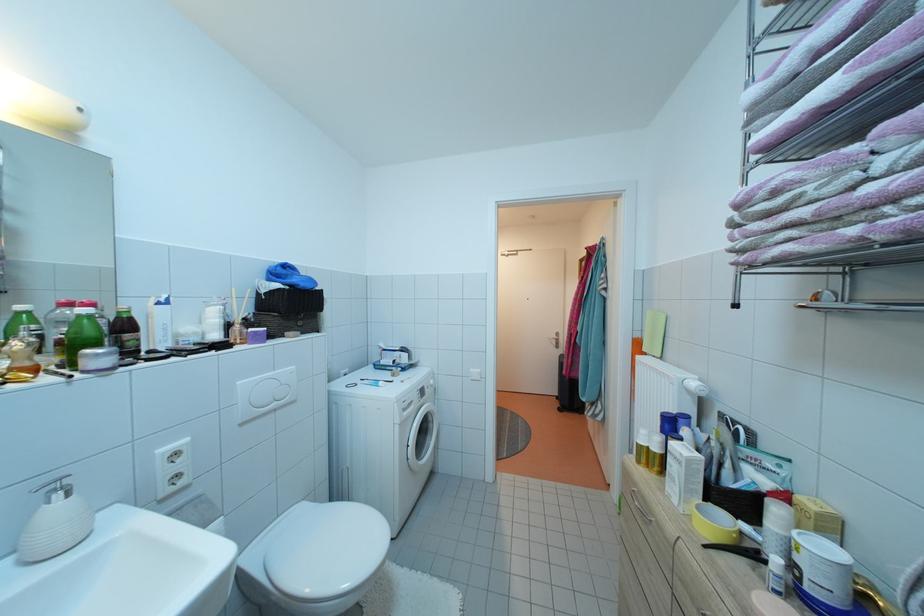
The image size is (924, 616). What do you see at coordinates (714, 524) in the screenshot?
I see `the yellow plastic bowl` at bounding box center [714, 524].